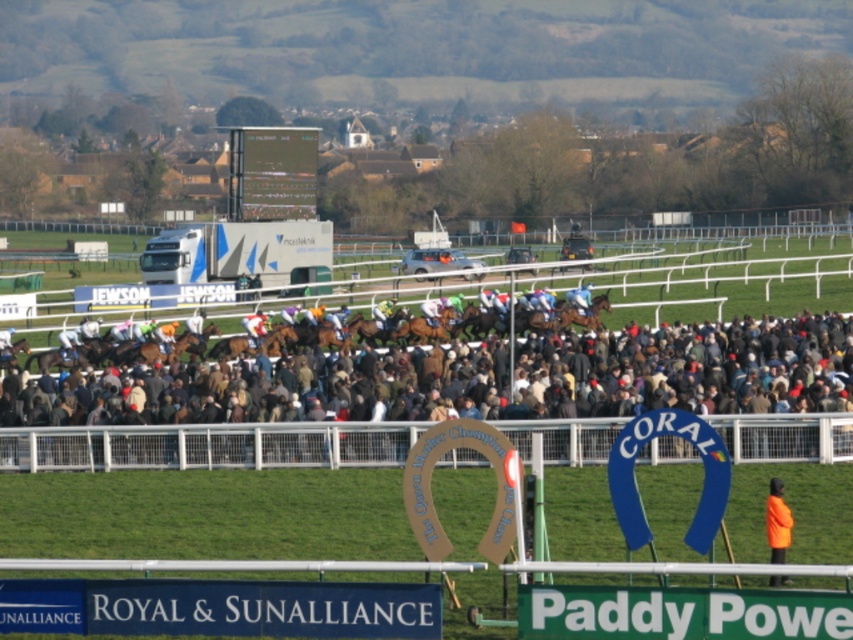
From the picture: You are a photographer trying to capture the crowd and the two large signs at the horse racing event. You notice a point at coordinates (445,397) in the image. What object is located at this point?

The point at coordinates (445,397) is on the brown woolen coat at center.

Looking at this image, you are a photographer trying to capture the horse race. You notice the brown woolen coat at center and the orange reflective jacket at lower right in your viewfinder. Which object should you focus on to ensure it appears larger in your photo?

The brown woolen coat at center is closer to the viewer than the orange reflective jacket at lower right, so focusing on it will make it appear larger in the photo.